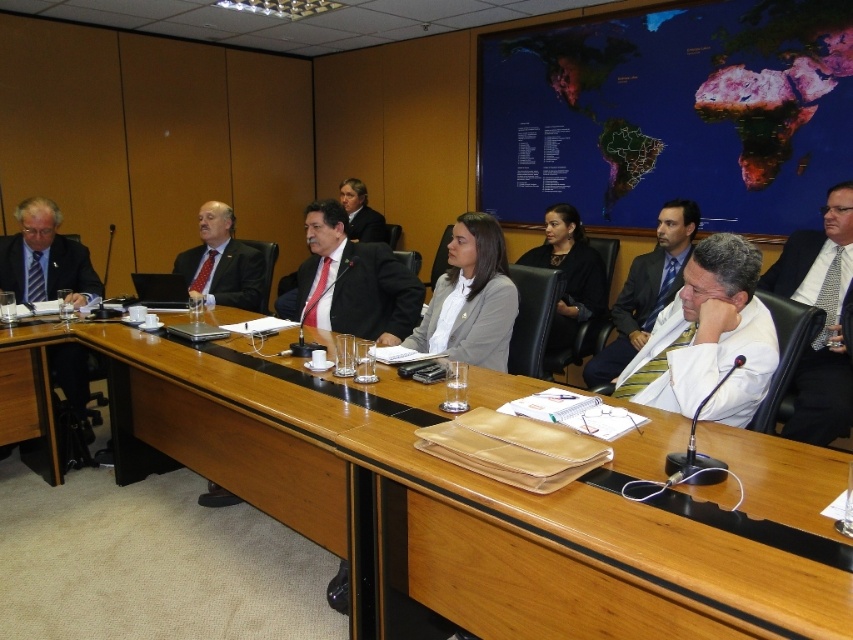
Which of these two, white lab coat at center or black fabric jacket at center, stands shorter?

white lab coat at center

Who is taller, white lab coat at center or black fabric jacket at center?

Standing taller between the two is black fabric jacket at center.

Is point (677, 332) closer to viewer compared to point (550, 241)?

Yes, point (677, 332) is in front of point (550, 241).

Identify the location of white lab coat at center. (708, 339).

Who is taller, white shirt at right or matte black suit at left?

With more height is matte black suit at left.

Can you confirm if white shirt at right is thinner than matte black suit at left?

Yes, white shirt at right is thinner than matte black suit at left.

Is point (817, 348) more distant than point (21, 212)?

No, (817, 348) is closer to viewer.

Identify the location of white shirt at right. The image size is (853, 640). (824, 321).

Is wooden table at center thinner than white shirt at right?

No, wooden table at center is not thinner than white shirt at right.

Identify the location of wooden table at center. This screenshot has height=640, width=853. (422, 502).